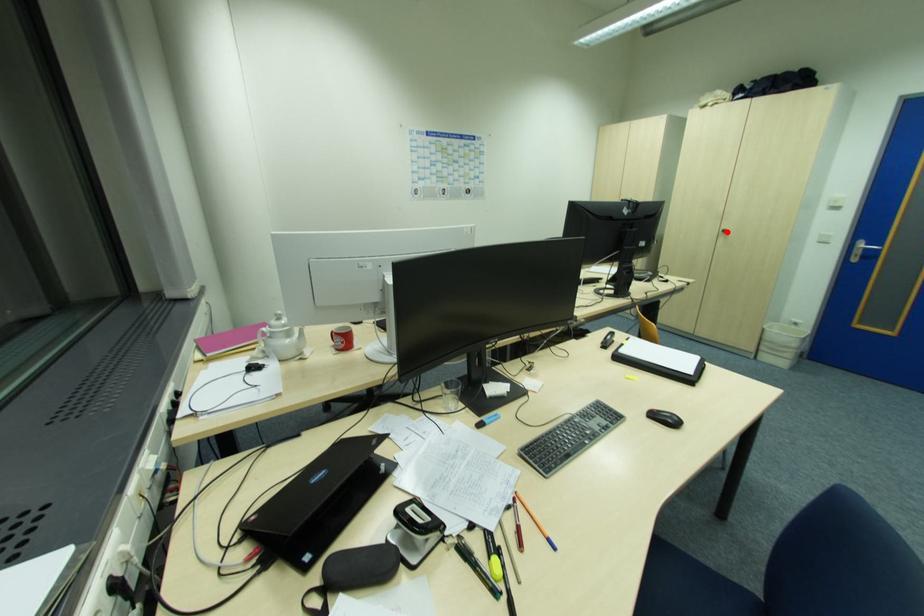
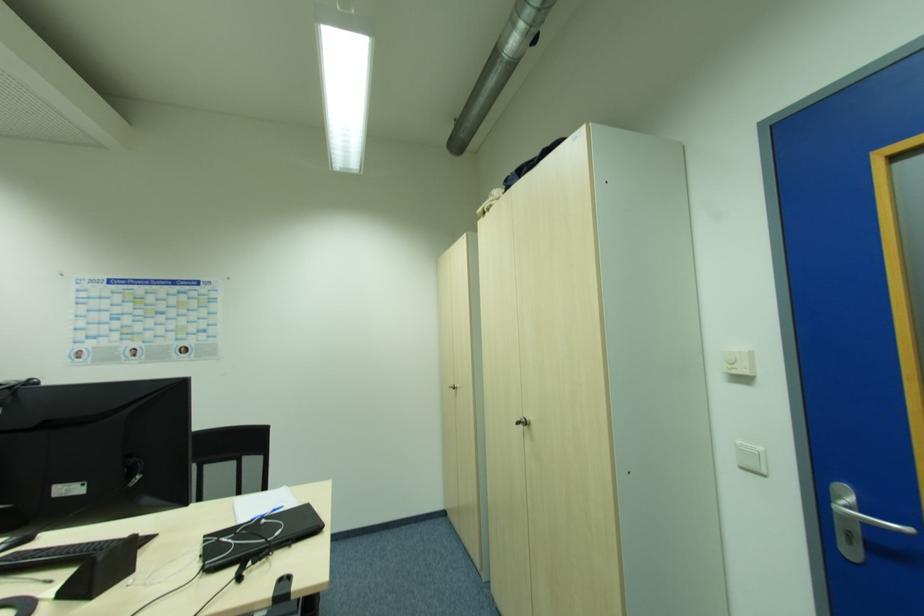
Locate, in the second image, the point that corresponds to the highlighted location in the first image.

(526, 424)